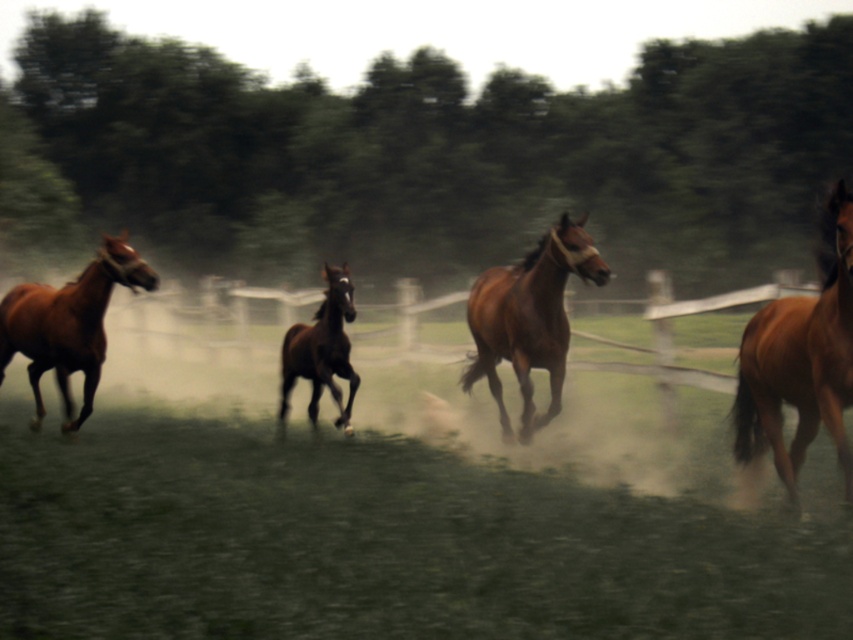
Question: Among these points, which one is nearest to the camera?

Choices:
 (A) (567, 220)
 (B) (93, 323)
 (C) (782, 259)

Answer: (A)

Question: Is green leafy tree at center closer to the viewer compared to shiny brown horse at left?

Choices:
 (A) no
 (B) yes

Answer: (A)

Question: Based on their relative distances, which object is nearer to the brown glossy horse at right?

Choices:
 (A) shiny brown horse at left
 (B) green leafy tree at center

Answer: (A)

Question: Which is nearer to the shiny brown horse at left?

Choices:
 (A) green leafy tree at center
 (B) brown glossy horse at right
 (C) shiny brown horse at center
 (D) brown glossy horse at center

Answer: (C)

Question: Can you confirm if green leafy tree at center is smaller than shiny brown horse at center?

Choices:
 (A) no
 (B) yes

Answer: (A)

Question: Can you confirm if green leafy tree at center is positioned to the right of shiny brown horse at left?

Choices:
 (A) yes
 (B) no

Answer: (A)